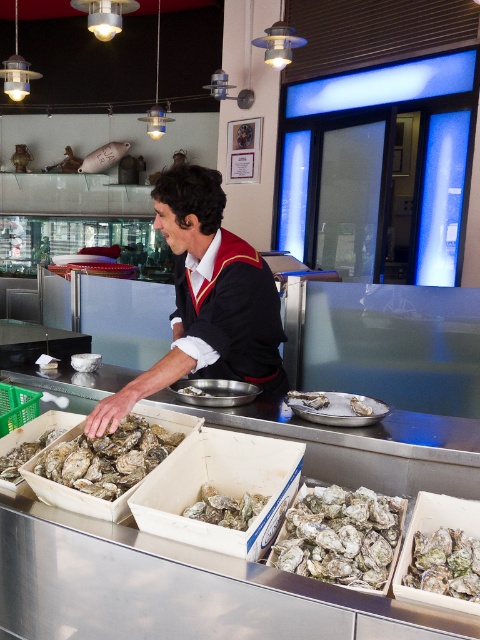
Is black fabric shirt at center bigger than shiny silver oyster at lower left?

Yes.

Looking at this image, does black fabric shirt at center have a greater width compared to shiny silver oyster at lower left?

Indeed, black fabric shirt at center has a greater width compared to shiny silver oyster at lower left.

Is point (252, 310) positioned behind point (1, 456)?

Yes, it is behind point (1, 456).

You are a GUI agent. You are given a task and a screenshot of the screen. Output one action in this format:
    pyautogui.click(x=<x>, y=<y>)
    Task: Click on the black fabric shirt at center
    
    Given the screenshot: What is the action you would take?
    pyautogui.click(x=205, y=298)

Is shiny silver oyster at center taller than shiny silver oyster at lower left?

Yes.

Between point (75, 448) and point (13, 477), which one is positioned behind?

The point (75, 448) is behind.

Who is more forward, [80,476] or [19,477]?

Point [80,476] is more forward.

The image size is (480, 640). I want to click on shiny silver oyster at center, so click(108, 458).

In the scene shown: Who is higher up, shiny gray oyster at center or white matte oyster at center?

white matte oyster at center

Between shiny gray oyster at center and white matte oyster at center, which one has less height?

Standing shorter between the two is white matte oyster at center.

Is point (392, 515) less distant than point (195, 516)?

Yes, point (392, 515) is closer to viewer.

The image size is (480, 640). I want to click on shiny gray oyster at center, so click(342, 536).